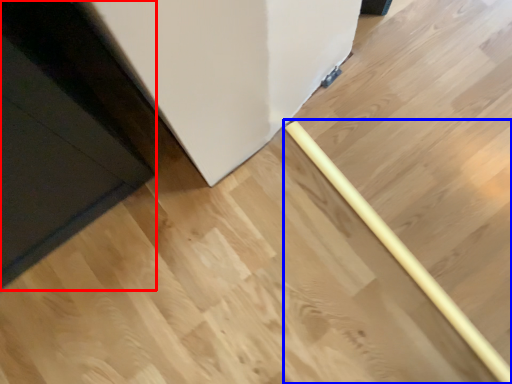
Question: Which object appears farthest to the camera in this image, door (highlighted by a red box) or rolling pin (highlighted by a blue box)?

Choices:
 (A) door
 (B) rolling pin

Answer: (B)